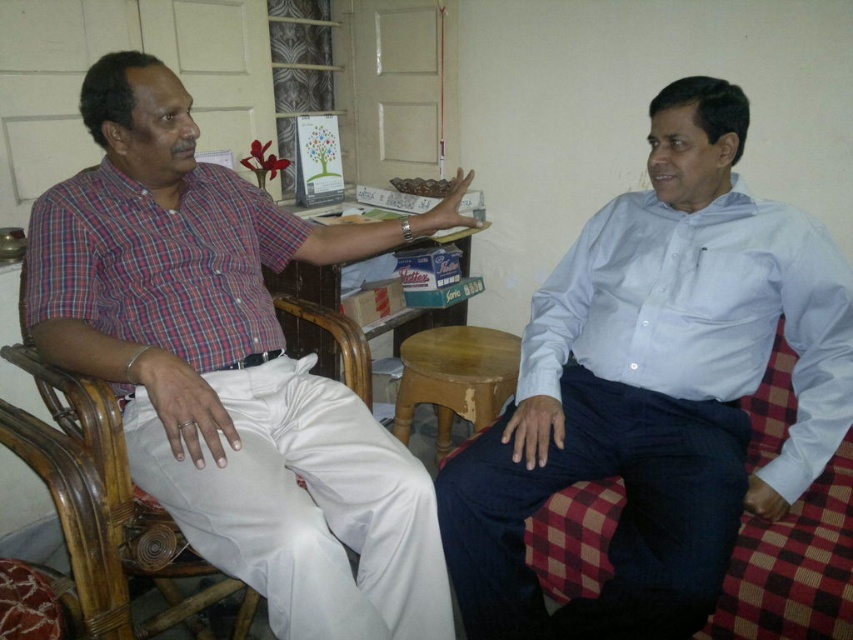
You are a person who is 1.7 meters tall and want to sit comfortably in either the checkered fabric armchair at right or the wooden stool at center. Based on their heights, which one would be more suitable for you?

The checkered fabric armchair at right is taller than wooden stool at center, so it would be more suitable for someone of your height as it provides a better seating position.

You need to sit down in this room but want to choose a seat that is higher than the other. Which one should you choose between the white fabric armchair at left and the wooden stool at center?

The white fabric armchair at left is much taller than the wooden stool at center, so you should choose the white fabric armchair at left.

You are a photographer setting up a shoot in this room. You need to position a light source to the right of both the matte plaid shirt at left and the checkered fabric armchair at right. Is this possible?

The matte plaid shirt at left is to the left of checkered fabric armchair at right, so placing a light source to the right of both would require positioning it further to the right of the checkered fabric armchair at right. This is possible as there is space beyond the armchair.